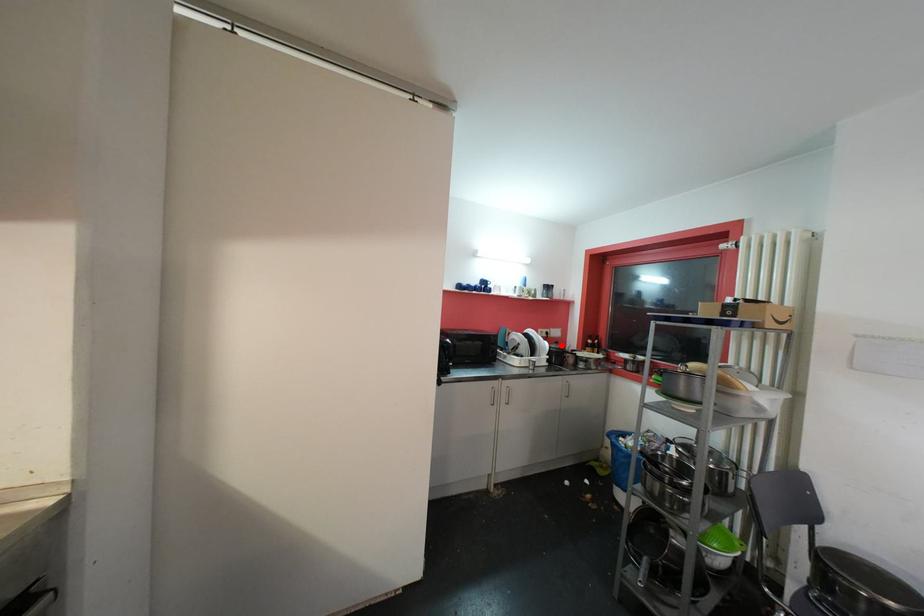
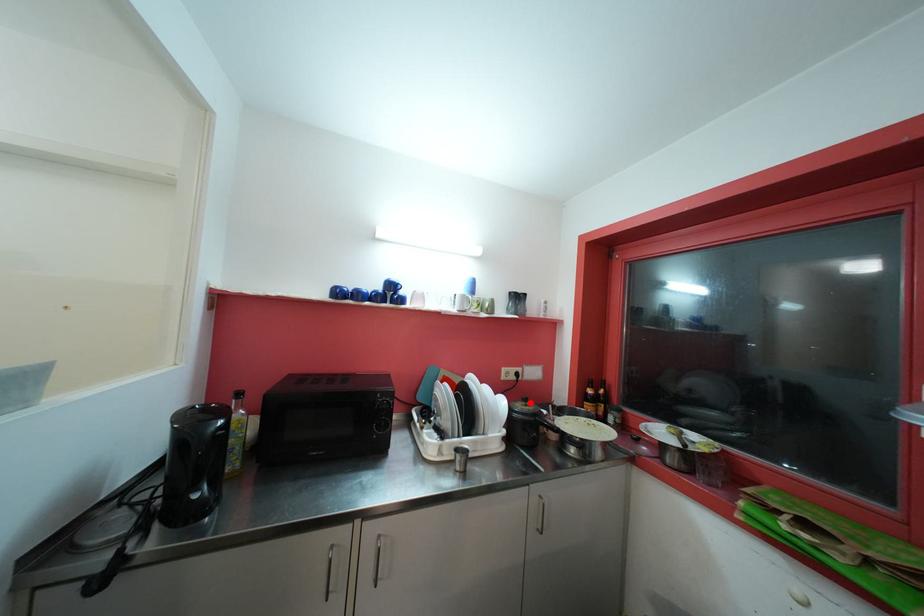
I am providing you with two images of the same scene from different viewpoints. A red point is marked on the first image and another point is marked on the second image. Do the highlighted points in image1 and image2 indicate the same real-world spot?

Yes